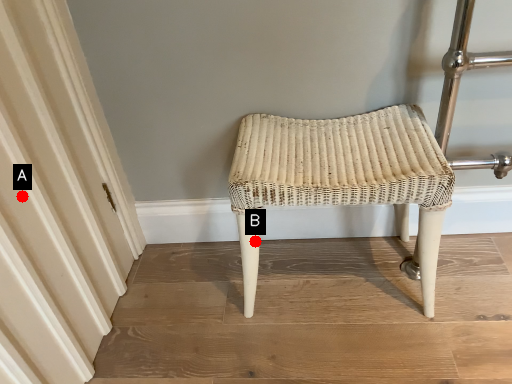
Question: Two points are circled on the image, labeled by A and B beside each circle. Which point appears farthest from the camera in this image?

Choices:
 (A) A is further
 (B) B is further

Answer: (B)